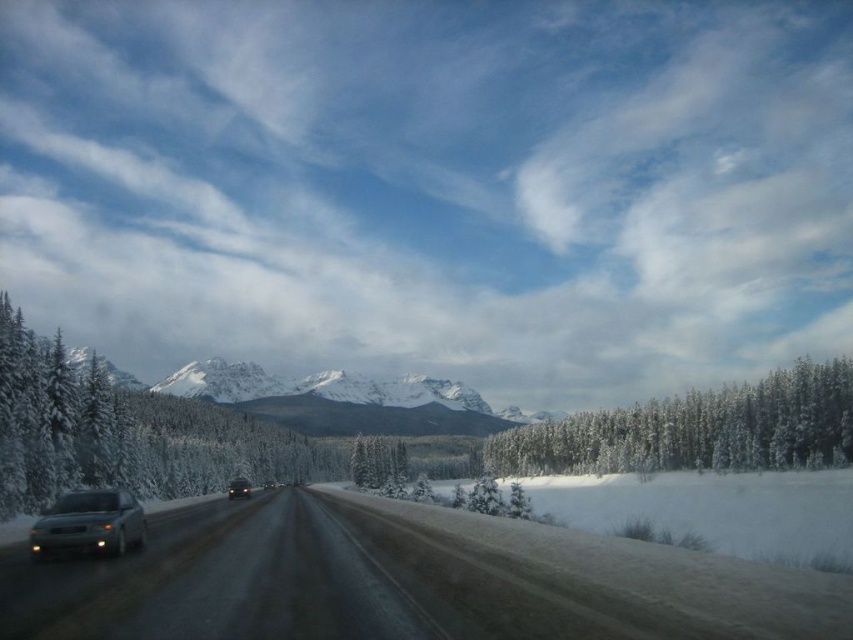
Question: Can you confirm if white snow-covered tree at center is positioned to the right of matte silver sedan at center?

Choices:
 (A) no
 (B) yes

Answer: (B)

Question: Considering the real-world distances, which object is closest to the white snow-covered tree at center?

Choices:
 (A) snow-covered evergreen at left
 (B) slick asphalt road at center
 (C) satin silver sedan at left

Answer: (A)

Question: Among these points, which one is nearest to the camera?

Choices:
 (A) (161, 385)
 (B) (248, 481)
 (C) (577, 467)

Answer: (B)

Question: Which point is closer to the camera?

Choices:
 (A) (33, 371)
 (B) (840, 420)
 (C) (238, 497)
 (D) (259, 390)

Answer: (A)

Question: Can you confirm if snowy granite mountain at center is smaller than matte silver sedan at center?

Choices:
 (A) yes
 (B) no

Answer: (B)

Question: Does snow-covered evergreen at left have a lesser width compared to matte silver sedan at center?

Choices:
 (A) no
 (B) yes

Answer: (A)